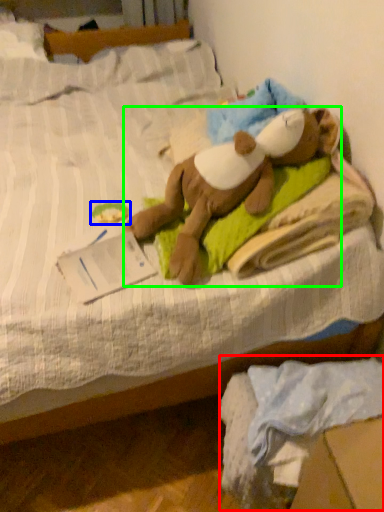
Question: Considering the real-world distances, which object is closest to material (highlighted by a red box)? toy (highlighted by a blue box) or person (highlighted by a green box).

Choices:
 (A) toy
 (B) person

Answer: (B)